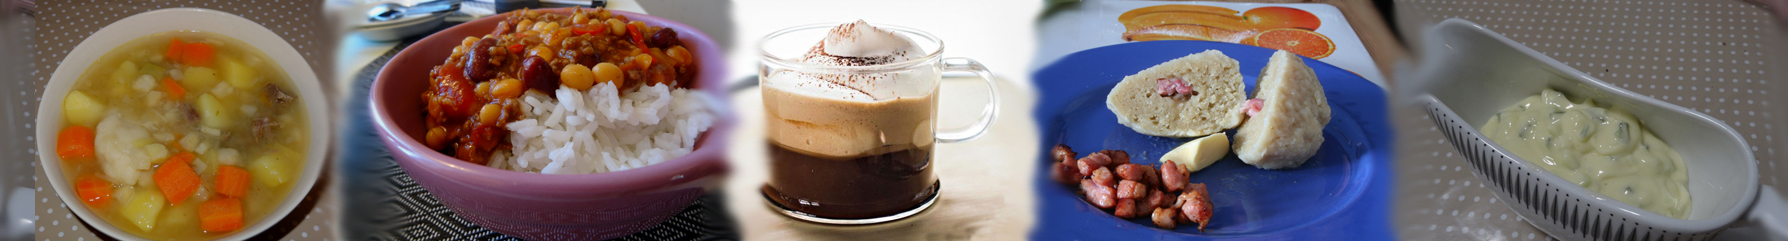
Identify the location of decorative table cloth. The width and height of the screenshot is (1788, 241). (48, 15), (434, 229), (1468, 210), (1336, 46).